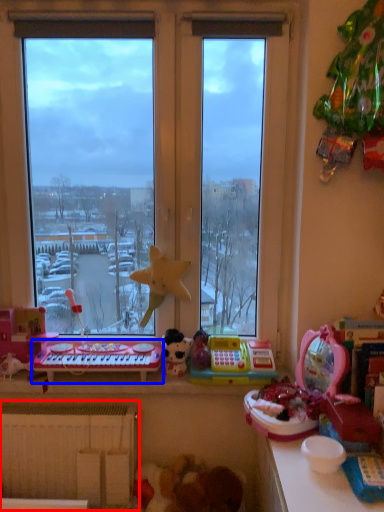
Question: Which point is further to the camera, radiator (highlighted by a red box) or musical keyboard (highlighted by a blue box)?

Choices:
 (A) radiator
 (B) musical keyboard

Answer: (B)